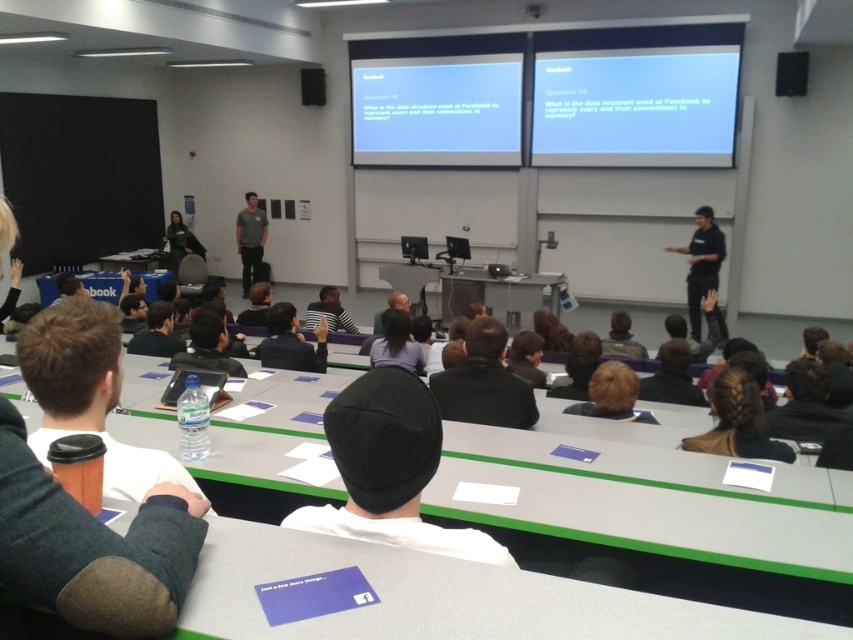
Where is `black leather jacket at center`? The width and height of the screenshot is (853, 640). black leather jacket at center is located at coordinates (485, 381).

This screenshot has width=853, height=640. Describe the element at coordinates (485, 381) in the screenshot. I see `black leather jacket at center` at that location.

I want to click on black leather jacket at center, so click(485, 381).

In the scene shown: Does white plastic table at center have a greater width compared to black leather jacket at center?

Correct, the width of white plastic table at center exceeds that of black leather jacket at center.

Is point (850, 577) less distant than point (531, 404)?

That is True.

Does point (592, 513) come farther from viewer compared to point (474, 364)?

No.

This screenshot has width=853, height=640. Identify the location of white plastic table at center. (650, 500).

Does white matte projection screen at upper center have a greater height compared to brown paper cup at lower left?

Yes, white matte projection screen at upper center is taller than brown paper cup at lower left.

Can you confirm if white matte projection screen at upper center is positioned to the right of brown paper cup at lower left?

Indeed, white matte projection screen at upper center is positioned on the right side of brown paper cup at lower left.

The image size is (853, 640). I want to click on white matte projection screen at upper center, so click(635, 106).